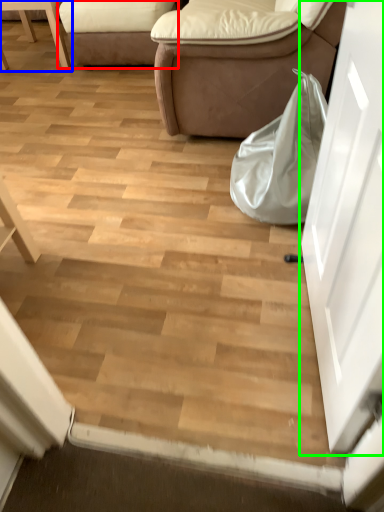
Question: Estimate the real-world distances between objects in this image. Which object is farther from studio couch (highlighted by a red box), furniture (highlighted by a blue box) or door (highlighted by a green box)?

Choices:
 (A) furniture
 (B) door

Answer: (B)